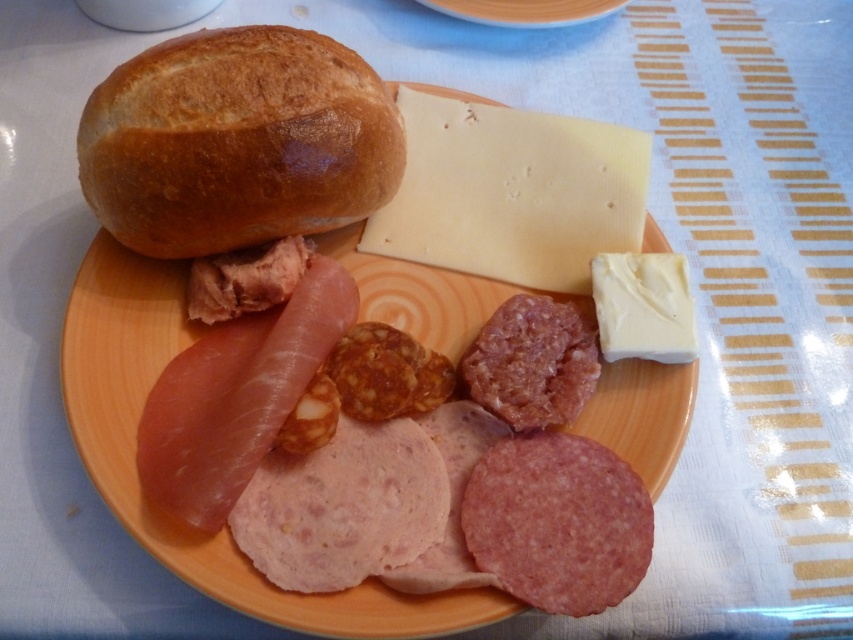
Question: Based on their relative distances, which object is nearer to the yellowish semi-hard cheese at upper center?

Choices:
 (A) pink textured salami at center
 (B) matte brown bread at upper left

Answer: (A)

Question: From the image, what is the correct spatial relationship of golden brown crusty bun at upper left in relation to orange matte plate at center?

Choices:
 (A) right
 (B) left

Answer: (B)

Question: Does yellowish semi-hard cheese at upper center appear under white creamy cheese at upper right?

Choices:
 (A) yes
 (B) no

Answer: (B)

Question: Among these points, which one is nearest to the camera?

Choices:
 (A) (366, 598)
 (B) (471, 161)

Answer: (A)

Question: Is golden brown crusty bun at upper left positioned before yellowish semi-hard cheese at upper center?

Choices:
 (A) yes
 (B) no

Answer: (A)

Question: Among these objects, which one is farthest from the camera?

Choices:
 (A) golden brown crusty bun at upper left
 (B) pink textured salami at center

Answer: (A)